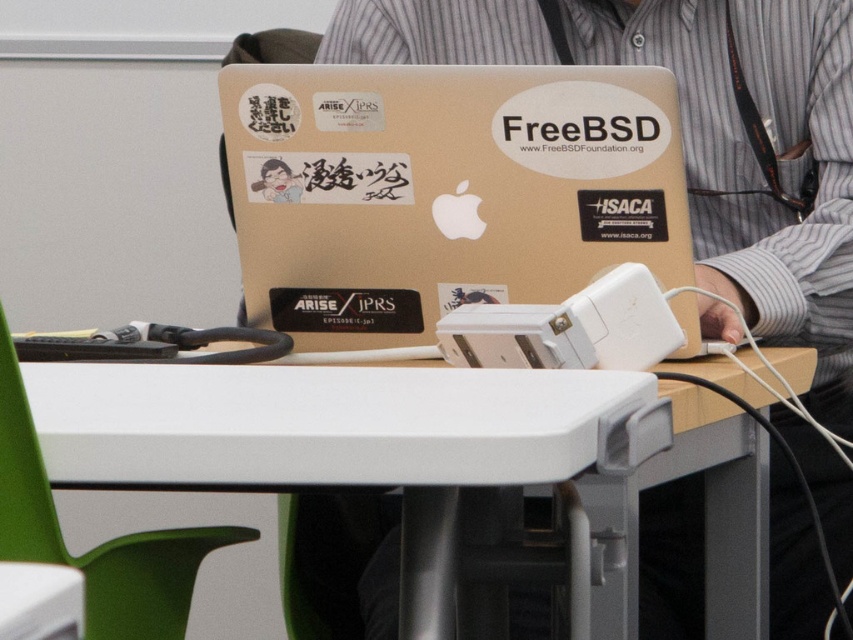
Question: Is glossy plastic laptop at center above metallic gold laptop at center?

Choices:
 (A) no
 (B) yes

Answer: (B)

Question: Which point is farther to the camera?

Choices:
 (A) (592, 508)
 (B) (302, 182)
 (C) (814, 381)

Answer: (C)

Question: Can you confirm if glossy plastic laptop at center is positioned to the left of metallic gold laptop at center?

Choices:
 (A) no
 (B) yes

Answer: (B)

Question: Which object is the farthest from the metallic gold laptop at center?

Choices:
 (A) glossy plastic laptop at center
 (B) white plastic table at center

Answer: (B)

Question: Can you confirm if glossy plastic laptop at center is smaller than metallic gold laptop at center?

Choices:
 (A) no
 (B) yes

Answer: (B)

Question: Among these objects, which one is nearest to the camera?

Choices:
 (A) white plastic table at center
 (B) glossy plastic laptop at center

Answer: (A)